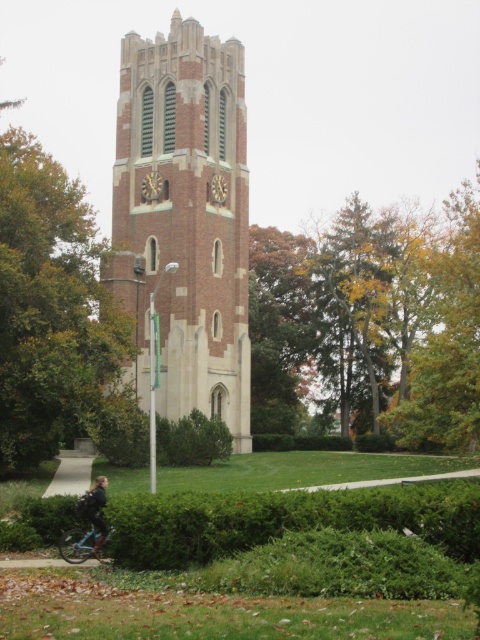
You are a photographer trying to capture the brick tower at center and the dark blue fabric jacket at lower left in the same frame. Considering their sizes, which object will appear larger in your photo?

The brick tower at center will appear larger in the photo because it is much taller than the dark blue fabric jacket at lower left.

You are standing at the base of the clock tower and want to take a photo of both the green leafy tree at left and the dark blue fabric jacket at lower left. Which object should you adjust your camera angle to focus on first to ensure both are in frame?

The green leafy tree at left is positioned on the left side of dark blue fabric jacket at lower left, so you should adjust your camera angle to focus on the green leafy tree at left first to ensure both are in frame.